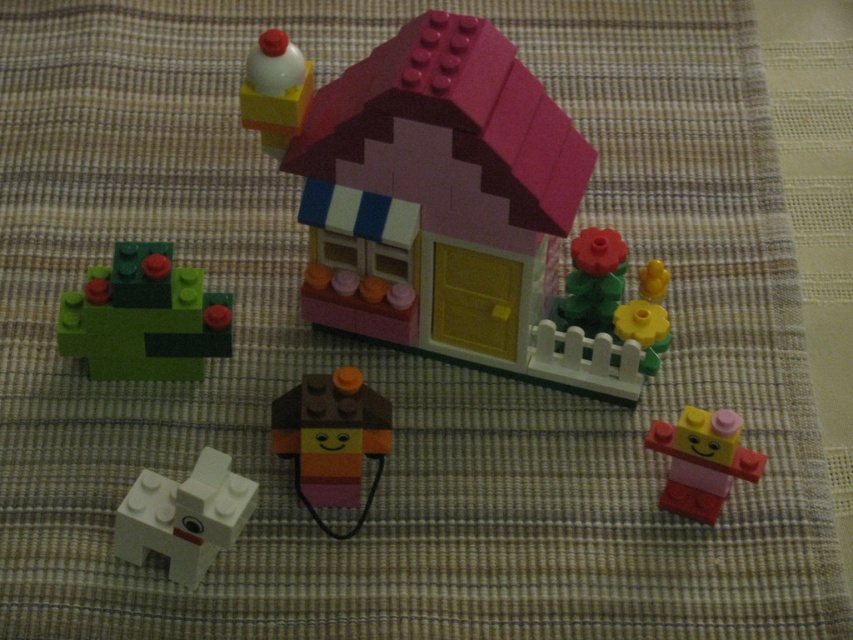
Question: Does pink plastic house at center appear over smooth brown and orange face at center?

Choices:
 (A) yes
 (B) no

Answer: (A)

Question: Is pink plastic house at center thinner than yellow matte flower at center-right?

Choices:
 (A) no
 (B) yes

Answer: (A)

Question: Which point is closer to the camera?

Choices:
 (A) pink plastic house at center
 (B) white matte brick at lower left
 (C) yellow matte flower at center-right
 (D) smooth brown and orange face at center

Answer: (A)

Question: Among these objects, which one is nearest to the camera?

Choices:
 (A) pink matte plastic figure at lower right
 (B) white matte milk bottle at upper center
 (C) white matte brick at lower left
 (D) yellow matte flower at center-right

Answer: (C)

Question: Among these points, which one is nearest to the camera?

Choices:
 (A) (494, 36)
 (B) (733, 429)

Answer: (B)

Question: Is green matte plant at lower left bigger than white matte brick at lower left?

Choices:
 (A) no
 (B) yes

Answer: (B)